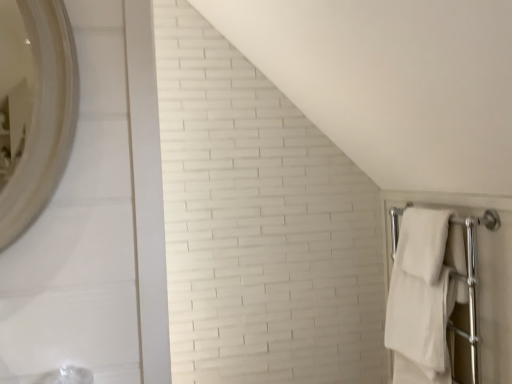
Measure the distance between white soft towel at right, which is the first bath towel in bottom-to-top order, and camera.

The depth of white soft towel at right, which is the first bath towel in bottom-to-top order, is 5.57 feet.

What do you see at coordinates (424, 293) in the screenshot? The image size is (512, 384). I see `white soft towel at right, which appears as the 2th bath towel when viewed from the top` at bounding box center [424, 293].

Find the location of a particular element. white soft towel at right, which is the first bath towel in bottom-to-top order is located at coordinates (424, 293).

Measure the distance between point (x=404, y=352) and camera.

A distance of 1.94 meters exists between point (x=404, y=352) and camera.

What is the approximate width of white soft towel at right, which appears as the 2th bath towel when viewed from the top?

white soft towel at right, which appears as the 2th bath towel when viewed from the top, is 4.62 inches wide.

This screenshot has width=512, height=384. What are the coordinates of `white soft towel at right, the 2th bath towel in the bottom-to-top sequence` in the screenshot? It's located at (422, 242).

The image size is (512, 384). What do you see at coordinates (422, 242) in the screenshot?
I see `white soft towel at right, which is the first bath towel in top-to-bottom order` at bounding box center [422, 242].

You are a GUI agent. You are given a task and a screenshot of the screen. Output one action in this format:
    pyautogui.click(x=<x>, y=<y>)
    Task: Click on the white soft towel at right, which is the first bath towel in bottom-to-top order
    
    Given the screenshot: What is the action you would take?
    pyautogui.click(x=424, y=293)

Considering the relative positions of white soft towel at right, which is the first bath towel in bottom-to-top order, and white soft towel at right, the 2th bath towel in the bottom-to-top sequence, in the image provided, is white soft towel at right, which is the first bath towel in bottom-to-top order, to the left of white soft towel at right, the 2th bath towel in the bottom-to-top sequence, from the viewer's perspective?

Correct, you'll find white soft towel at right, which is the first bath towel in bottom-to-top order, to the left of white soft towel at right, the 2th bath towel in the bottom-to-top sequence.

Is white soft towel at right, which is the first bath towel in bottom-to-top order, further to the viewer compared to white soft towel at right, which is the first bath towel in top-to-bottom order?

Yes, it is behind white soft towel at right, which is the first bath towel in top-to-bottom order.

Is point (436, 263) closer to viewer compared to point (438, 268)?

Yes, it is.

From the image's perspective, is white soft towel at right, which appears as the 2th bath towel when viewed from the top, located above or below white soft towel at right, the 2th bath towel in the bottom-to-top sequence?

Based on their image positions, white soft towel at right, which appears as the 2th bath towel when viewed from the top, is located beneath white soft towel at right, the 2th bath towel in the bottom-to-top sequence.

From a real-world perspective, does white soft towel at right, which is the first bath towel in bottom-to-top order, stand above white soft towel at right, which is the first bath towel in top-to-bottom order?

No, from a real-world perspective, white soft towel at right, which is the first bath towel in bottom-to-top order, is not over white soft towel at right, which is the first bath towel in top-to-bottom order

Does white soft towel at right, which is the first bath towel in bottom-to-top order, have a greater width compared to white soft towel at right, which is the first bath towel in top-to-bottom order?

Indeed, white soft towel at right, which is the first bath towel in bottom-to-top order, has a greater width compared to white soft towel at right, which is the first bath towel in top-to-bottom order.

Who is shorter, white soft towel at right, which is the first bath towel in bottom-to-top order, or white soft towel at right, which is the first bath towel in top-to-bottom order?

With less height is white soft towel at right, which is the first bath towel in top-to-bottom order.

Consider the image. Considering the relative sizes of white soft towel at right, which is the first bath towel in bottom-to-top order, and white soft towel at right, the 2th bath towel in the bottom-to-top sequence, in the image provided, is white soft towel at right, which is the first bath towel in bottom-to-top order, smaller than white soft towel at right, the 2th bath towel in the bottom-to-top sequence,?

Actually, white soft towel at right, which is the first bath towel in bottom-to-top order, might be larger than white soft towel at right, the 2th bath towel in the bottom-to-top sequence.

Is white soft towel at right, which is the first bath towel in top-to-bottom order, located within white soft towel at right, which appears as the 2th bath towel when viewed from the top?

No, white soft towel at right, which is the first bath towel in top-to-bottom order, is not surrounded by white soft towel at right, which appears as the 2th bath towel when viewed from the top.

Is white soft towel at right, which appears as the 2th bath towel when viewed from the top, next to white soft towel at right, which is the first bath towel in top-to-bottom order?

Indeed, white soft towel at right, which appears as the 2th bath towel when viewed from the top, and white soft towel at right, which is the first bath towel in top-to-bottom order, are beside each other and touching.

Could you tell me if white soft towel at right, which is the first bath towel in bottom-to-top order, is facing white soft towel at right, the 2th bath towel in the bottom-to-top sequence?

No, white soft towel at right, which is the first bath towel in bottom-to-top order, is not oriented towards white soft towel at right, the 2th bath towel in the bottom-to-top sequence.

Where is `bath towel on the right of the white soft towel at right, which appears as the 2th bath towel when viewed from the top`? bath towel on the right of the white soft towel at right, which appears as the 2th bath towel when viewed from the top is located at coordinates (422, 242).

Which object is positioned more to the right, white soft towel at right, the 2th bath towel in the bottom-to-top sequence, or white soft towel at right, which is the first bath towel in bottom-to-top order?

white soft towel at right, the 2th bath towel in the bottom-to-top sequence.

Considering their positions, is white soft towel at right, the 2th bath towel in the bottom-to-top sequence, located in front of or behind white soft towel at right, which is the first bath towel in bottom-to-top order?

Visually, white soft towel at right, the 2th bath towel in the bottom-to-top sequence, is located in front of white soft towel at right, which is the first bath towel in bottom-to-top order.

Does point (413, 231) come farther from viewer compared to point (441, 338)?

Yes, point (413, 231) is behind point (441, 338).

From the image's perspective, which one is positioned higher, white soft towel at right, which is the first bath towel in top-to-bottom order, or white soft towel at right, which appears as the 2th bath towel when viewed from the top?

white soft towel at right, which is the first bath towel in top-to-bottom order, is shown above in the image.

From a real-world perspective, is white soft towel at right, which is the first bath towel in top-to-bottom order, above or below white soft towel at right, which is the first bath towel in bottom-to-top order?

Clearly, from a real-world perspective, white soft towel at right, which is the first bath towel in top-to-bottom order, is above white soft towel at right, which is the first bath towel in bottom-to-top order.

Can you confirm if white soft towel at right, the 2th bath towel in the bottom-to-top sequence, is thinner than white soft towel at right, which is the first bath towel in bottom-to-top order?

Correct, the width of white soft towel at right, the 2th bath towel in the bottom-to-top sequence, is less than that of white soft towel at right, which is the first bath towel in bottom-to-top order.

Does white soft towel at right, the 2th bath towel in the bottom-to-top sequence, have a lesser height compared to white soft towel at right, which appears as the 2th bath towel when viewed from the top?

Yes.

In terms of size, does white soft towel at right, the 2th bath towel in the bottom-to-top sequence, appear bigger or smaller than white soft towel at right, which is the first bath towel in bottom-to-top order?

In the image, white soft towel at right, the 2th bath towel in the bottom-to-top sequence, appears to be smaller than white soft towel at right, which is the first bath towel in bottom-to-top order.

Would you say white soft towel at right, which is the first bath towel in top-to-bottom order, is inside or outside white soft towel at right, which appears as the 2th bath towel when viewed from the top?

white soft towel at right, which is the first bath towel in top-to-bottom order, is outside white soft towel at right, which appears as the 2th bath towel when viewed from the top.

Is white soft towel at right, which is the first bath towel in top-to-bottom order, far from white soft towel at right, which is the first bath towel in bottom-to-top order?

white soft towel at right, which is the first bath towel in top-to-bottom order, is near white soft towel at right, which is the first bath towel in bottom-to-top order, not far away.

Looking at this image, could you tell me if white soft towel at right, which is the first bath towel in top-to-bottom order, is facing white soft towel at right, which is the first bath towel in bottom-to-top order?

No, white soft towel at right, which is the first bath towel in top-to-bottom order, is not aimed at white soft towel at right, which is the first bath towel in bottom-to-top order.

How different are the orientations of white soft towel at right, the 2th bath towel in the bottom-to-top sequence, and white soft towel at right, which appears as the 2th bath towel when viewed from the top, in degrees?

The angular difference between white soft towel at right, the 2th bath towel in the bottom-to-top sequence, and white soft towel at right, which appears as the 2th bath towel when viewed from the top, is 0.00313 degrees.

How far apart are white soft towel at right, the 2th bath towel in the bottom-to-top sequence, and white soft towel at right, which appears as the 2th bath towel when viewed from the top?

white soft towel at right, the 2th bath towel in the bottom-to-top sequence, and white soft towel at right, which appears as the 2th bath towel when viewed from the top, are 3.73 inches apart.

Locate an element on the screen. Image resolution: width=512 pixels, height=384 pixels. bath towel that appears in front of the white soft towel at right, which appears as the 2th bath towel when viewed from the top is located at coordinates (422, 242).

You are a GUI agent. You are given a task and a screenshot of the screen. Output one action in this format:
    pyautogui.click(x=<x>, y=<y>)
    Task: Click on the bath towel located on the right of white soft towel at right, which is the first bath towel in bottom-to-top order
    The height and width of the screenshot is (384, 512).
    Given the screenshot: What is the action you would take?
    pyautogui.click(x=422, y=242)

Where is `bath towel below the white soft towel at right, which is the first bath towel in top-to-bottom order (from a real-world perspective)`? This screenshot has height=384, width=512. bath towel below the white soft towel at right, which is the first bath towel in top-to-bottom order (from a real-world perspective) is located at coordinates (424, 293).